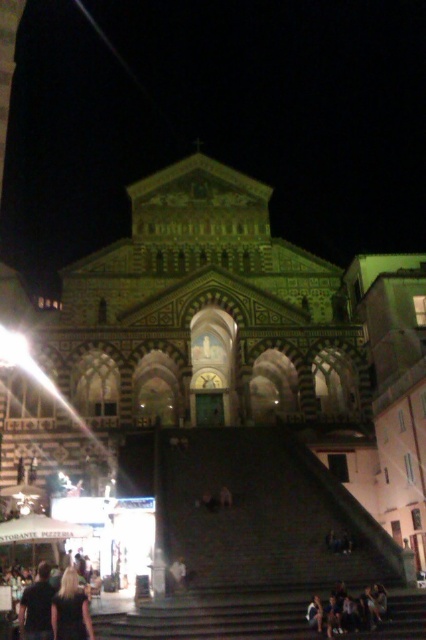
Question: Which point appears closest to the camera in this image?

Choices:
 (A) (77, 593)
 (B) (370, 618)

Answer: (A)

Question: Considering the relative positions of black fabric at lower left and dark brown leather jacket at lower left in the image provided, where is black fabric at lower left located with respect to dark brown leather jacket at lower left?

Choices:
 (A) left
 (B) right

Answer: (B)

Question: Which of the following is the farthest from the observer?

Choices:
 (A) dark blue jeans at lower center
 (B) black fabric at lower left

Answer: (A)

Question: Observing the image, what is the correct spatial positioning of black fabric at lower left in reference to dark brown leather jacket at lower left?

Choices:
 (A) above
 (B) below

Answer: (A)

Question: Estimate the real-world distances between objects in this image. Which object is closer to the black fabric at lower left?

Choices:
 (A) dark blue jeans at lower center
 (B) dark brown leather jacket at lower left

Answer: (B)

Question: From the image, what is the correct spatial relationship of black fabric at lower left in relation to dark brown leather jacket at lower left?

Choices:
 (A) above
 (B) below

Answer: (A)